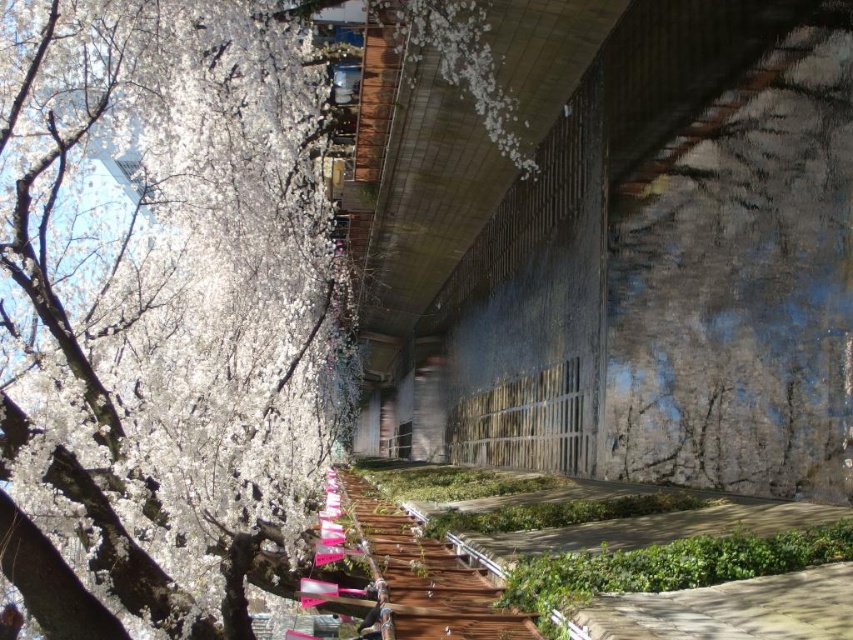
Does white blossoms at left appear on the right side of wooden walkway at center?

In fact, white blossoms at left is to the left of wooden walkway at center.

Is point (273, 356) farther from camera compared to point (426, 588)?

Yes, it is behind point (426, 588).

Does point (4, 504) come farther from viewer compared to point (408, 595)?

Yes.

The height and width of the screenshot is (640, 853). Find the location of `white blossoms at left`. white blossoms at left is located at coordinates (163, 314).